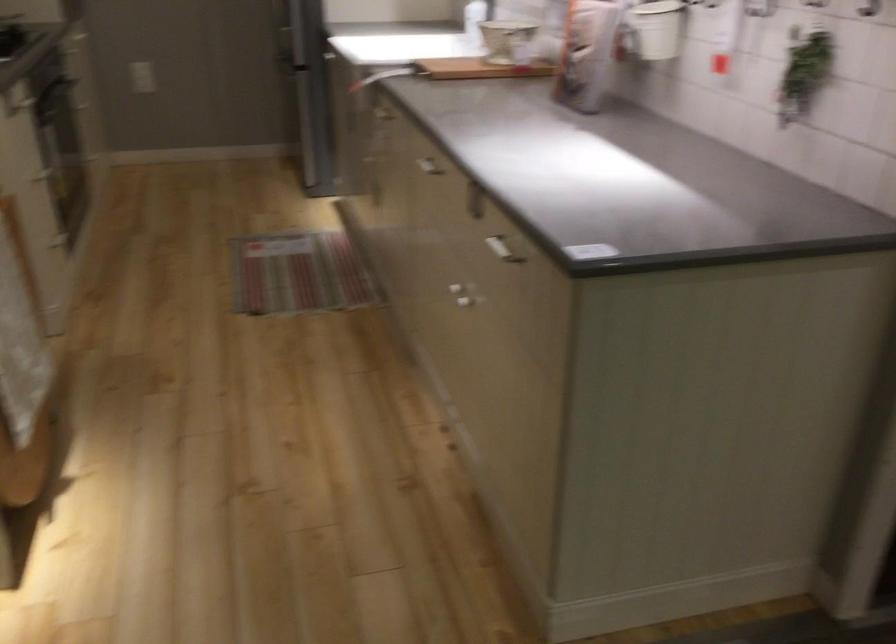
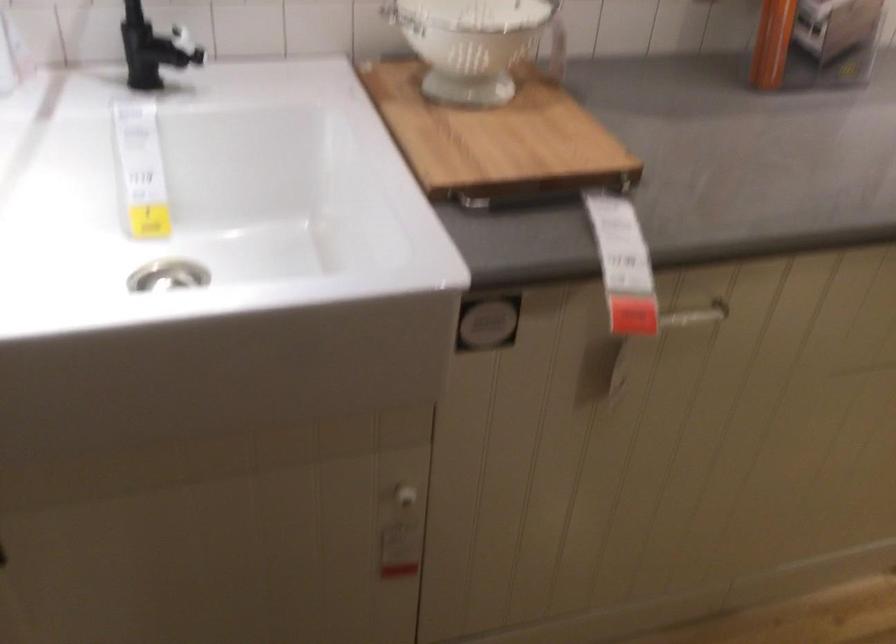
Locate, in the second image, the point that corresponds to point (382, 122) in the first image.

(695, 315)